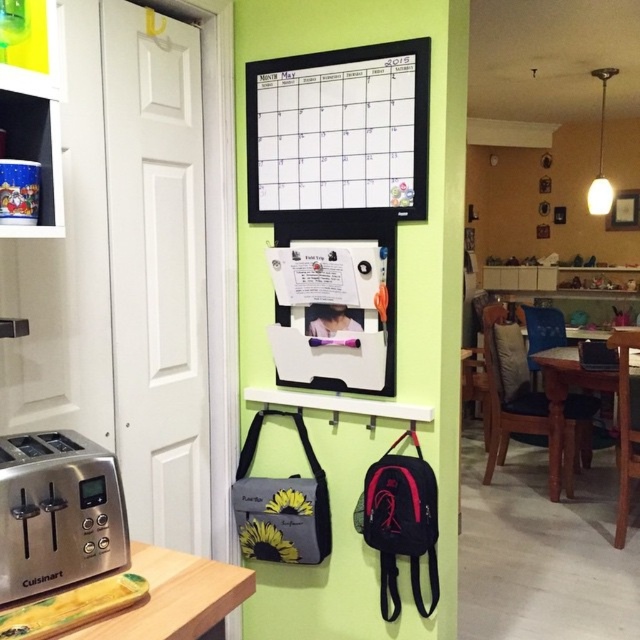
Question: Which point appears closest to the camera in this image?

Choices:
 (A) (134, 636)
 (B) (250, 109)
 (C) (92, 477)

Answer: (A)

Question: Which is nearer to the brown wooden table at center?

Choices:
 (A) white matte calendar at upper center
 (B) wooden table at lower left

Answer: (A)

Question: Which of these objects is positioned farthest from the stainless steel toaster at left?

Choices:
 (A) wooden table at lower left
 (B) brown wooden table at center

Answer: (B)

Question: Does wooden table at lower left appear over brown wooden table at center?

Choices:
 (A) yes
 (B) no

Answer: (B)

Question: From the image, what is the correct spatial relationship of stainless steel toaster at left in relation to brown wooden table at center?

Choices:
 (A) left
 (B) right

Answer: (A)

Question: Where is white matte calendar at upper center located in relation to brown wooden table at center in the image?

Choices:
 (A) below
 (B) above

Answer: (B)